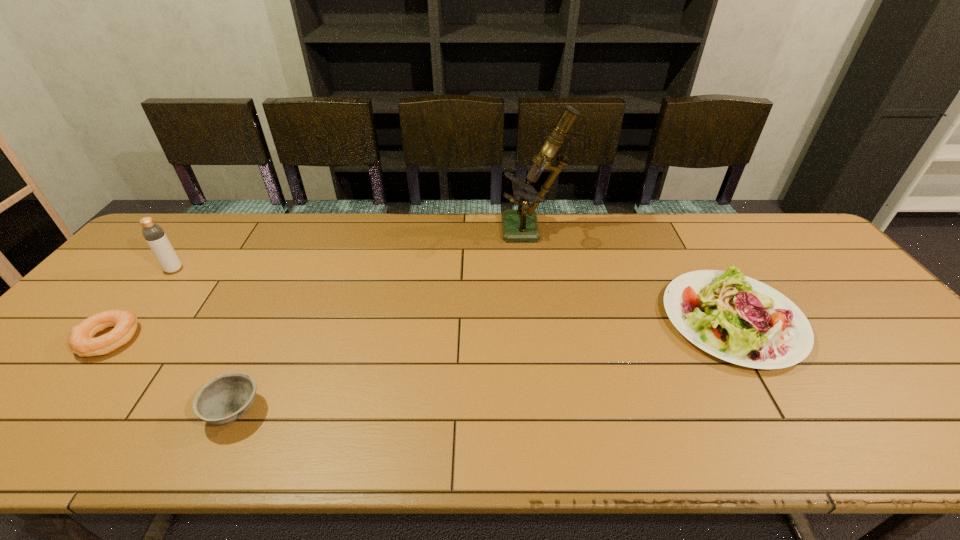
Where is `free space located 0.350m at the eyepiece of the fourth object from left to right`? Image resolution: width=960 pixels, height=540 pixels. free space located 0.350m at the eyepiece of the fourth object from left to right is located at coordinates (396, 231).

At what (x,y) coordinates should I click in order to perform the action: click on free spot located at the eyepiece of the fourth object from left to right. Please return your answer as a coordinate pair (x, y). The width and height of the screenshot is (960, 540). Looking at the image, I should click on (457, 231).

Find the location of a particular element. This screenshot has width=960, height=540. vacant region located 0.270m on the front of the bottle is located at coordinates [x=111, y=346].

The height and width of the screenshot is (540, 960). What are the coordinates of `vacant space positioned on the back of the third tallest object` in the screenshot? It's located at (674, 220).

This screenshot has width=960, height=540. I want to click on free space located on the right of the bowl, so pyautogui.click(x=429, y=411).

Locate an element on the screen. This screenshot has width=960, height=540. vacant region located on the back of the shortest object is located at coordinates (199, 231).

In order to click on object present at the far edge in this screenshot , I will do `click(521, 224)`.

Locate an element on the screen. The height and width of the screenshot is (540, 960). object that is at the near edge is located at coordinates (227, 397).

You are a GUI agent. You are given a task and a screenshot of the screen. Output one action in this format:
    pyautogui.click(x=<x>, y=<y>)
    Task: Click on the bottle that is at the left edge
    The height and width of the screenshot is (540, 960).
    Given the screenshot: What is the action you would take?
    pyautogui.click(x=154, y=235)

The image size is (960, 540). I want to click on bagel present at the left edge, so click(x=81, y=341).